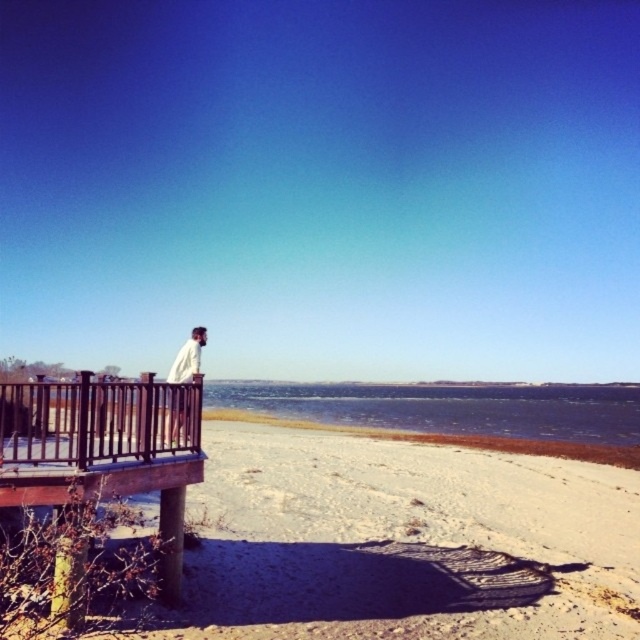
You are planning to install a 60 feet long walkway between the white sandy beach at lower left and the brown wooden balustrade at left. Based on the scene description, will the walkway be long enough to connect both areas?

The distance between the white sandy beach at lower left and the brown wooden balustrade at left is 55.95 feet. Since the proposed walkway is 60 feet long, it will be long enough to connect both areas with some extra length remaining.

You are standing on the beach and see two points marked on the sand. One is at coordinate point (358,616) and the other at point (173,380). Which point is nearer to you?

Point (358,616) is closer to the viewer than point (173,380).